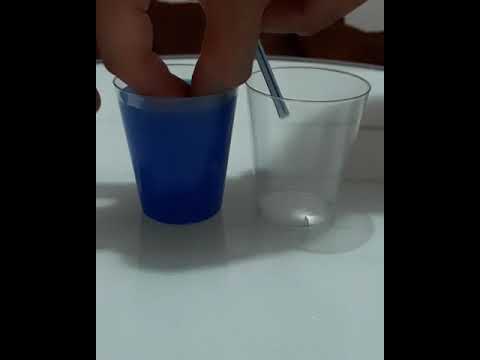
This screenshot has height=360, width=480. In order to click on cups in this screenshot , I will do `click(297, 185)`, `click(198, 166)`.